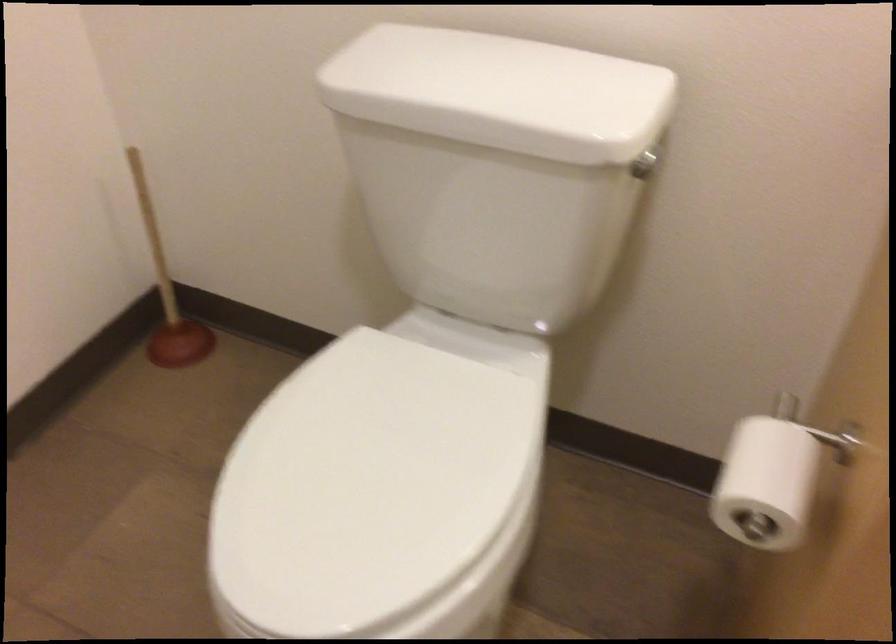
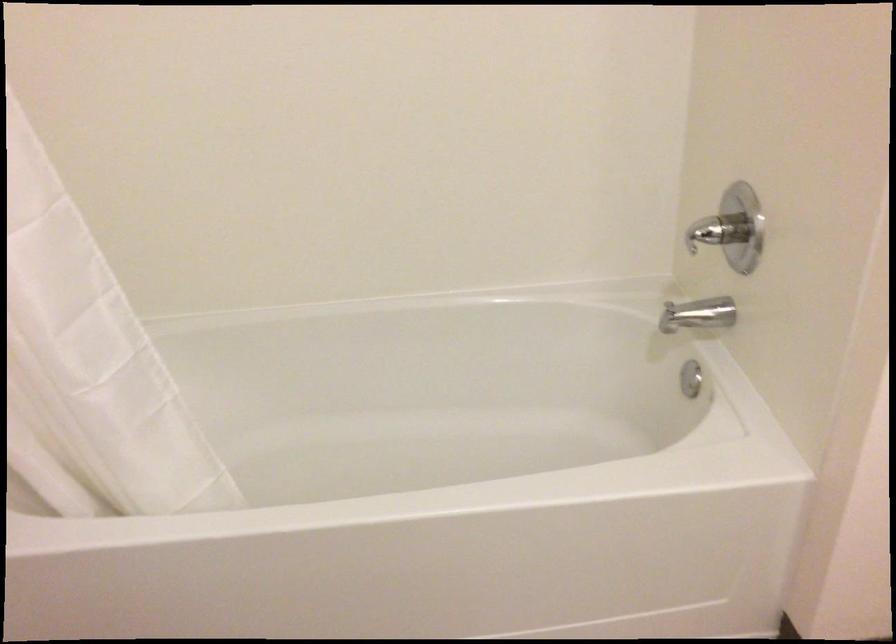
Question: The camera is either moving clockwise (left) or counter-clockwise (right) around the object. The first image is from the beginning of the video and the second image is from the end. Is the camera moving left or right when shooting the video?

Choices:
 (A) Left
 (B) Right

Answer: (B)